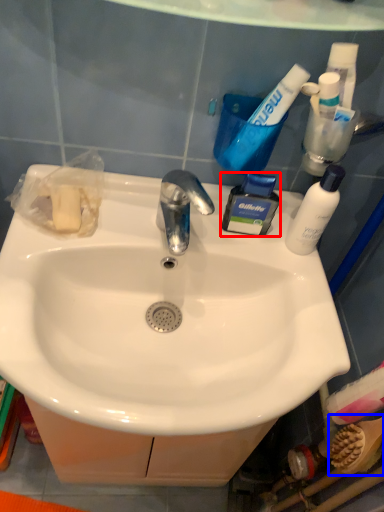
Question: Which point is closer to the camera, toiletry (highlighted by a red box) or brush (highlighted by a blue box)?

Choices:
 (A) toiletry
 (B) brush

Answer: (B)